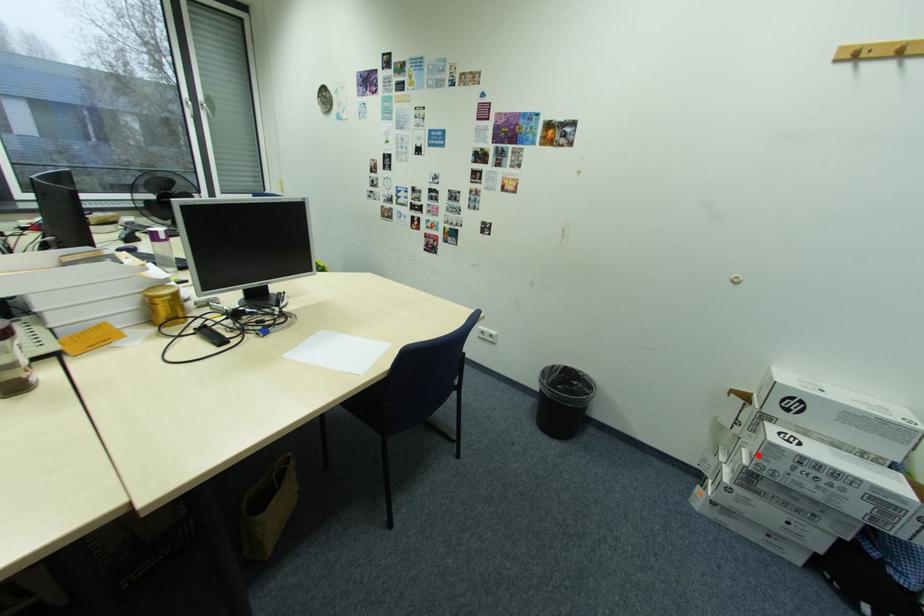
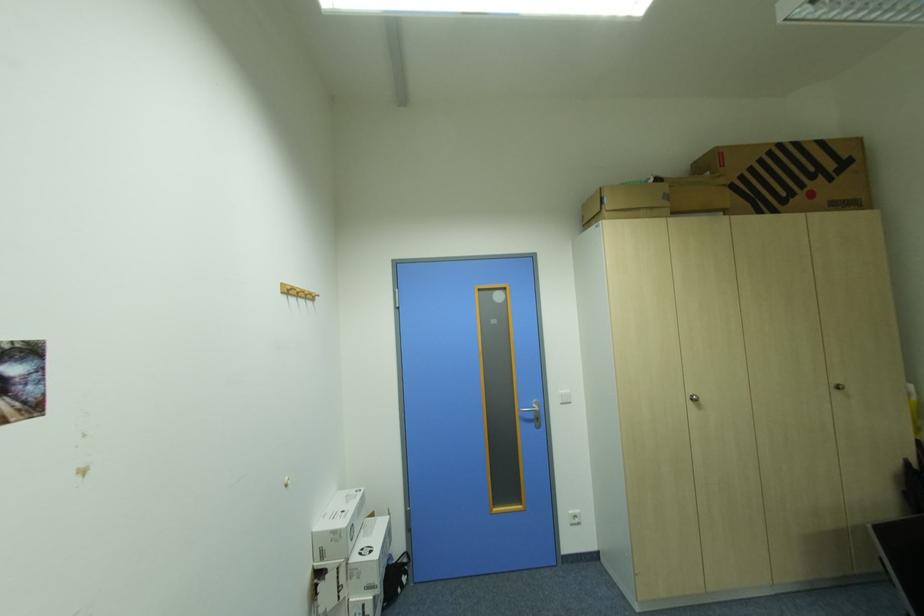
In the second image, find the point that corresponds to the highlighted location in the first image.

(377, 590)